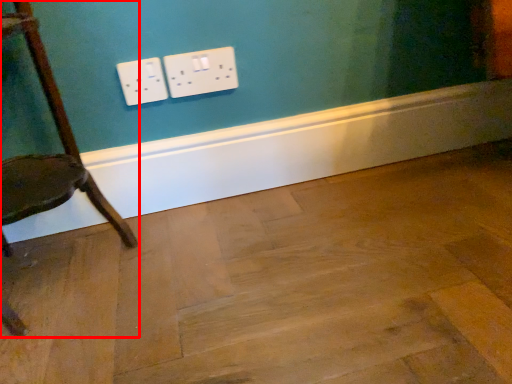
Question: In this image, where is chair (annotated by the red box) located relative to plywood?

Choices:
 (A) right
 (B) left

Answer: (B)